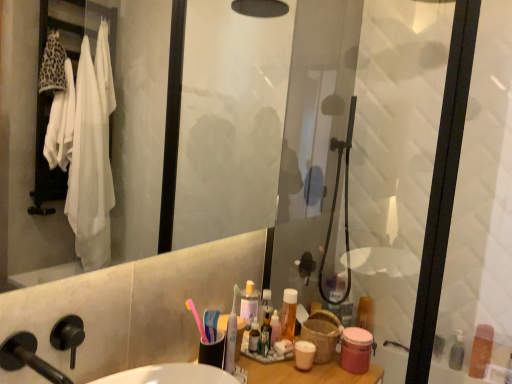
Question: Considering the positions of white plastic toothbrush at center and matte plastic container at right, which is the 1th toiletry from back to front, in the image, is white plastic toothbrush at center bigger or smaller than matte plastic container at right, which is the 1th toiletry from back to front,?

Choices:
 (A) small
 (B) big

Answer: (A)

Question: In terms of height, does white plastic toothbrush at center look taller or shorter compared to matte plastic container at right, the 2th toiletry in the right-to-left sequence?

Choices:
 (A) tall
 (B) short

Answer: (A)

Question: Considering the real-world distances, which object is closest to the transparent glass shower door at right?

Choices:
 (A) pink matte jar at lower right, placed as the 3th toiletry when sorted from right to left
 (B) matte plastic container at right, which is the 1th toiletry from back to front
 (C) white plastic toothbrush at center
 (D) black matte faucet at lower left
 (E) translucent orange bottle at upper right, which is the fourth toiletry from right to left

Answer: (B)

Question: Based on their relative distances, which object is nearer to the matte plastic container at right, the 4th toiletry positioned from the front?

Choices:
 (A) transparent glass shower door at right
 (B) translucent plastic bottle at lower right, the third toiletry from the front
 (C) pink matte jar at lower right, placed as the first toiletry when sorted from front to back
 (D) white plastic toothbrush at center
 (E) black matte faucet at lower left

Answer: (B)